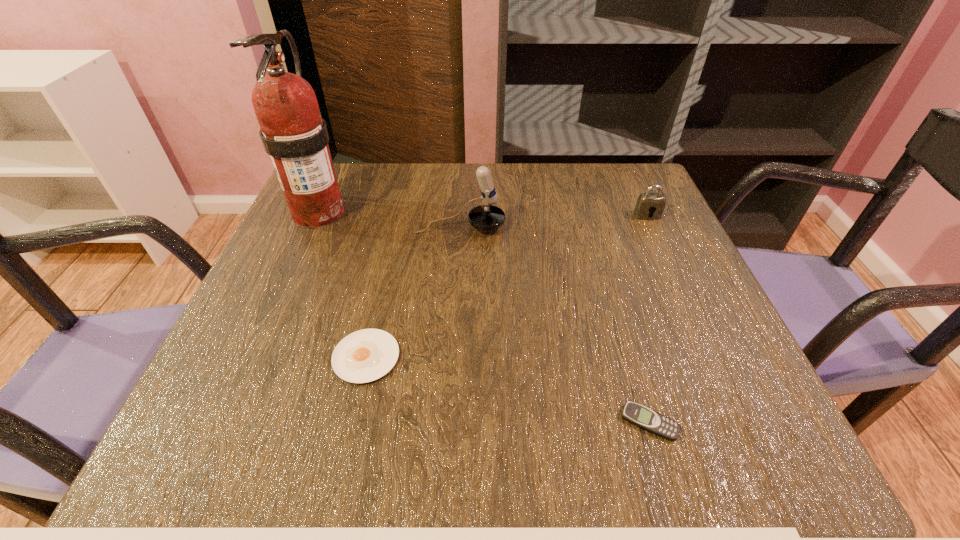
I want to click on free space in the image that satisfies the following two spatial constraints: 1. at the nozzle of the leftmost object; 2. on the right side of the second tallest object, so click(313, 227).

This screenshot has width=960, height=540. What are the coordinates of `vacant region that satisfies the following two spatial constraints: 1. on the front side of the egg yolk; 2. on the right side of the beeper` in the screenshot? It's located at (351, 422).

The height and width of the screenshot is (540, 960). Identify the location of vacant space that satisfies the following two spatial constraints: 1. at the nozzle of the egg yolk; 2. on the right side of the leftmost object. (255, 357).